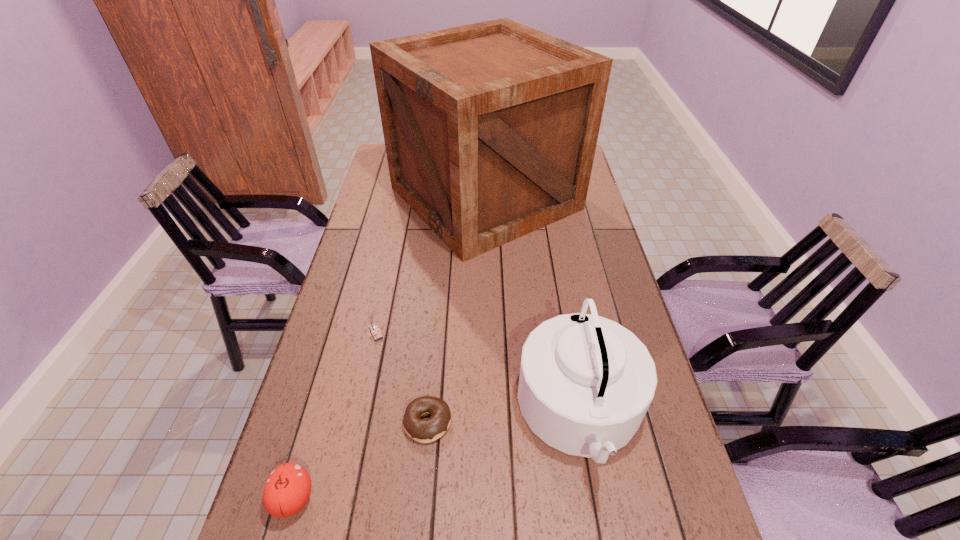
At what (x,y) coordinates should I click in order to perform the action: click on vacant position located 0.390m on the back of the fourth nearest object. Please return your answer as a coordinate pair (x, y). Looking at the image, I should click on (396, 235).

Find the location of a particular element. The width and height of the screenshot is (960, 540). vacant space located 0.220m on the right of the apple is located at coordinates (426, 499).

Locate an element on the screen. The width and height of the screenshot is (960, 540). free space located 0.100m on the front of the doughnut is located at coordinates (421, 493).

This screenshot has width=960, height=540. I want to click on object that is at the far edge, so click(x=490, y=129).

What are the coordinates of `box that is positioned at the left edge` in the screenshot? It's located at (490, 129).

Identify the location of matchbox located in the left edge section of the desktop. This screenshot has height=540, width=960. (372, 325).

Image resolution: width=960 pixels, height=540 pixels. What are the coordinates of `apple located at the left edge` in the screenshot? It's located at (287, 490).

The width and height of the screenshot is (960, 540). What are the coordinates of `box at the right edge` in the screenshot? It's located at (490, 129).

You are a GUI agent. You are given a task and a screenshot of the screen. Output one action in this format:
    pyautogui.click(x=<x>, y=<y>)
    Task: Click on the kettle present at the right edge
    This screenshot has height=540, width=960.
    Given the screenshot: What is the action you would take?
    pyautogui.click(x=586, y=382)

You are a GUI agent. You are given a task and a screenshot of the screen. Output one action in this format:
    pyautogui.click(x=<x>, y=<y>)
    Task: Click on the object located at the far left corner
    The image size is (960, 540).
    Given the screenshot: What is the action you would take?
    pyautogui.click(x=490, y=129)